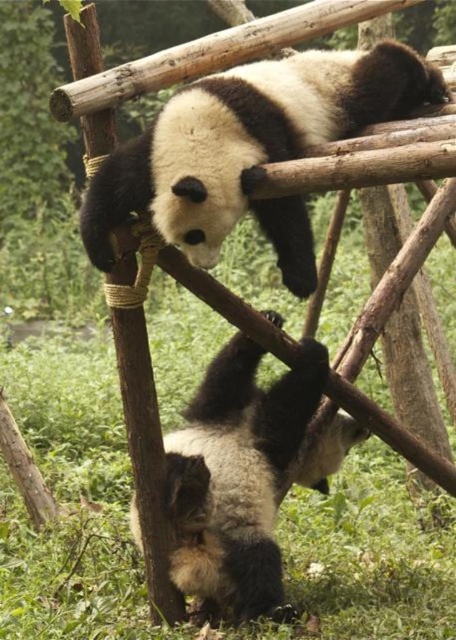
Question: Observing the image, what is the correct spatial positioning of black fuzzy panda at upper center in reference to soft fur panda at lower center?

Choices:
 (A) below
 (B) above

Answer: (B)

Question: Does black fuzzy panda at upper center have a smaller size compared to soft fur panda at lower center?

Choices:
 (A) no
 (B) yes

Answer: (A)

Question: Can you confirm if black fuzzy panda at upper center is wider than soft fur panda at lower center?

Choices:
 (A) yes
 (B) no

Answer: (A)

Question: Which object is farther from the camera taking this photo?

Choices:
 (A) black fuzzy panda at upper center
 (B) soft fur panda at lower center

Answer: (B)